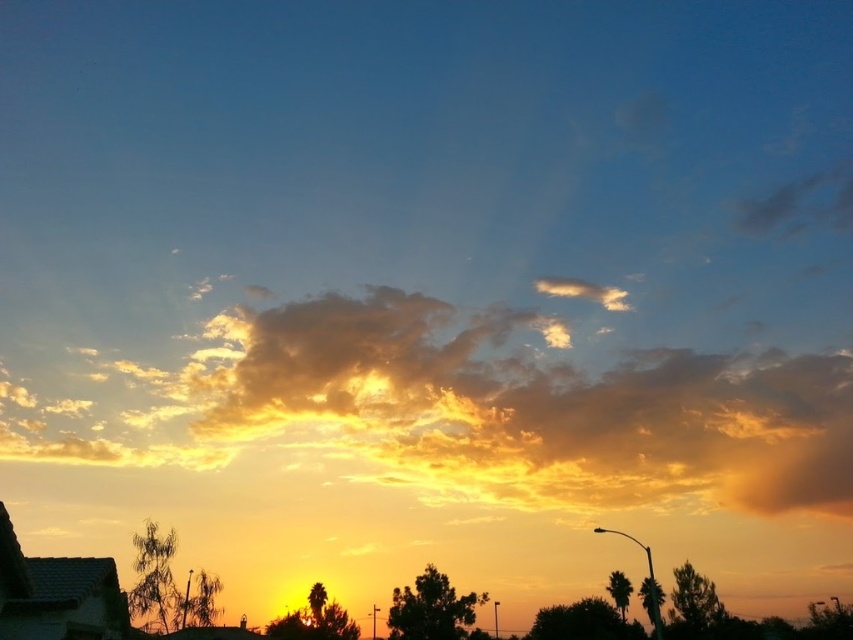
Question: Which point is closer to the camera taking this photo?

Choices:
 (A) (822, 362)
 (B) (599, 291)

Answer: (B)

Question: Considering the relative positions of golden fluffy cloud at center and cloudy cotton cloud at upper center in the image provided, where is golden fluffy cloud at center located with respect to cloudy cotton cloud at upper center?

Choices:
 (A) below
 (B) above

Answer: (A)

Question: Is golden fluffy cloud at center wider than cloudy cotton cloud at upper center?

Choices:
 (A) no
 (B) yes

Answer: (B)

Question: Where is golden fluffy cloud at center located in relation to cloudy cotton cloud at upper center in the image?

Choices:
 (A) left
 (B) right

Answer: (A)